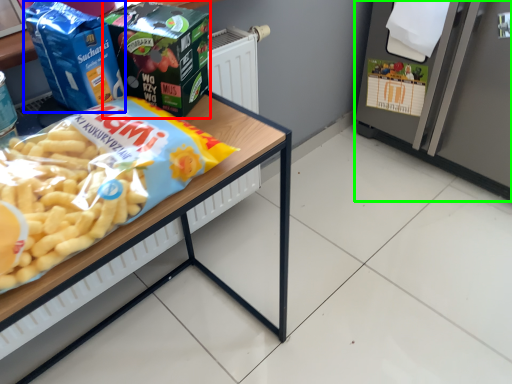
Question: Considering the real-world distances, which object is farthest from product (highlighted by a red box)? product (highlighted by a blue box) or appliance (highlighted by a green box)?

Choices:
 (A) product
 (B) appliance

Answer: (B)